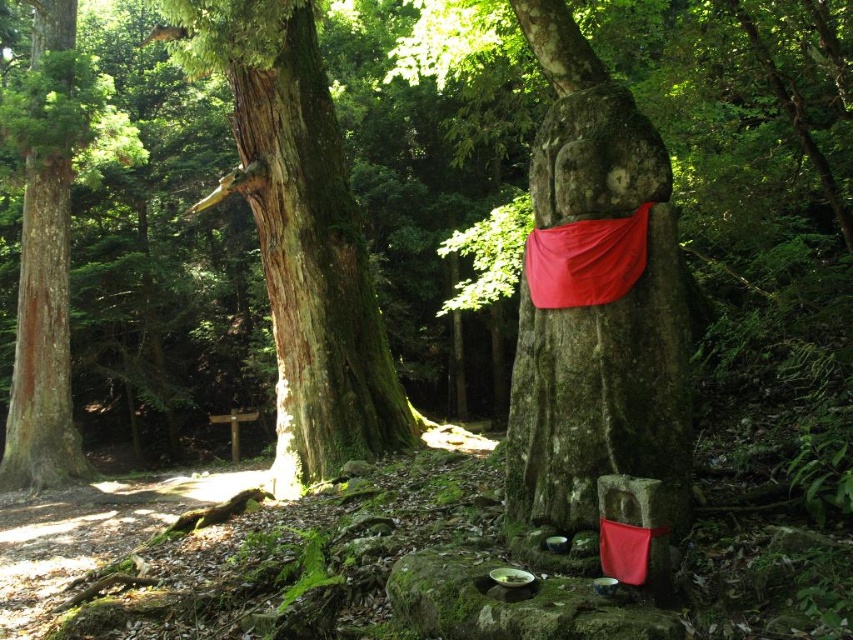
Can you confirm if green mossy stone statue at center is positioned to the left of green mossy tree at center?

In fact, green mossy stone statue at center is to the right of green mossy tree at center.

Does green mossy stone statue at center have a larger size compared to green mossy tree at center?

No, green mossy stone statue at center is not bigger than green mossy tree at center.

This screenshot has width=853, height=640. What are the coordinates of `green mossy stone statue at center` in the screenshot? It's located at (596, 307).

Between green mossy tree at center and red fabric at center, which one appears on the left side from the viewer's perspective?

From the viewer's perspective, green mossy tree at center appears more on the left side.

Can you confirm if green mossy tree at center is bigger than red fabric at center?

Yes.

The image size is (853, 640). I want to click on green mossy tree at center, so click(300, 236).

In order to click on green mossy tree at center in this screenshot , I will do `click(300, 236)`.

Can you confirm if green mossy stone statue at center is positioned to the right of smooth reddish-brown tree trunk at left?

Correct, you'll find green mossy stone statue at center to the right of smooth reddish-brown tree trunk at left.

Between green mossy stone statue at center and smooth reddish-brown tree trunk at left, which one appears on the right side from the viewer's perspective?

From the viewer's perspective, green mossy stone statue at center appears more on the right side.

Measure the distance between point (x=519, y=419) and camera.

Point (x=519, y=419) is 4.61 meters away from camera.

Locate an element on the screen. The height and width of the screenshot is (640, 853). green mossy stone statue at center is located at coordinates (596, 307).